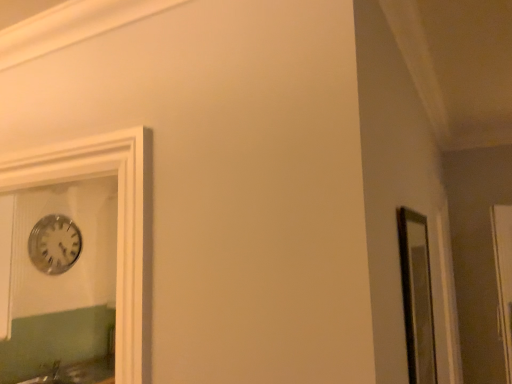
Question: From a real-world perspective, is matte glass mirror at right located beneath transparent glass door at right?

Choices:
 (A) no
 (B) yes

Answer: (A)

Question: From the image's perspective, is matte glass mirror at right located above transparent glass door at right?

Choices:
 (A) yes
 (B) no

Answer: (A)

Question: Is matte glass mirror at right surrounding transparent glass door at right?

Choices:
 (A) no
 (B) yes

Answer: (A)

Question: Can you confirm if matte glass mirror at right is smaller than transparent glass door at right?

Choices:
 (A) yes
 (B) no

Answer: (B)

Question: Can you confirm if matte glass mirror at right is taller than transparent glass door at right?

Choices:
 (A) no
 (B) yes

Answer: (A)

Question: From a real-world perspective, relative to transparent glass door at right, is matte glass mirror at right vertically above or below?

Choices:
 (A) below
 (B) above

Answer: (B)

Question: From the image's perspective, relative to transparent glass door at right, is matte glass mirror at right above or below?

Choices:
 (A) below
 (B) above

Answer: (B)

Question: Visually, is matte glass mirror at right positioned to the left or to the right of transparent glass door at right?

Choices:
 (A) left
 (B) right

Answer: (A)

Question: Based on their sizes in the image, would you say matte glass mirror at right is bigger or smaller than transparent glass door at right?

Choices:
 (A) big
 (B) small

Answer: (A)

Question: Considering their positions, is transparent glass door at right located in front of or behind matte glass mirror at right?

Choices:
 (A) front
 (B) behind

Answer: (B)

Question: In the image, is transparent glass door at right on the left side or the right side of matte glass mirror at right?

Choices:
 (A) right
 (B) left

Answer: (A)

Question: From the image's perspective, is transparent glass door at right located above or below matte glass mirror at right?

Choices:
 (A) below
 (B) above

Answer: (A)

Question: Looking at their shapes, would you say transparent glass door at right is wider or thinner than matte glass mirror at right?

Choices:
 (A) wide
 (B) thin

Answer: (A)

Question: Is transparent glass door at right wider or thinner than silver metallic clock at upper left?

Choices:
 (A) thin
 (B) wide

Answer: (B)

Question: Considering the positions of transparent glass door at right and silver metallic clock at upper left in the image, is transparent glass door at right taller or shorter than silver metallic clock at upper left?

Choices:
 (A) short
 (B) tall

Answer: (B)